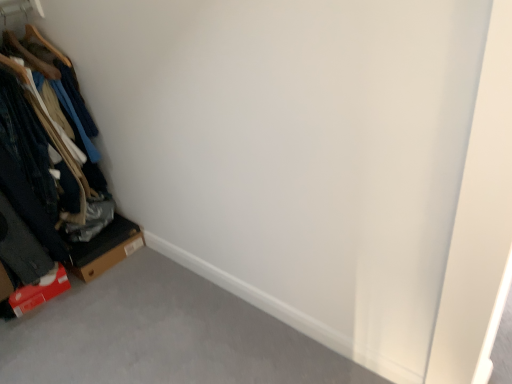
Question: In terms of size, does wooden hangers at left appear bigger or smaller than brown cardboard box at lower left?

Choices:
 (A) big
 (B) small

Answer: (A)

Question: From their relative heights in the image, would you say wooden hangers at left is taller or shorter than brown cardboard box at lower left?

Choices:
 (A) short
 (B) tall

Answer: (B)

Question: In the image, is wooden hangers at left on the left side or the right side of brown cardboard box at lower left?

Choices:
 (A) left
 (B) right

Answer: (A)

Question: In terms of height, does brown cardboard box at lower left look taller or shorter compared to wooden hangers at left?

Choices:
 (A) tall
 (B) short

Answer: (B)

Question: Is brown cardboard box at lower left spatially inside wooden hangers at left, or outside of it?

Choices:
 (A) outside
 (B) inside

Answer: (A)

Question: Considering the positions of brown cardboard box at lower left and wooden hangers at left in the image, is brown cardboard box at lower left wider or thinner than wooden hangers at left?

Choices:
 (A) thin
 (B) wide

Answer: (A)

Question: From the image's perspective, relative to wooden hangers at left, is brown cardboard box at lower left above or below?

Choices:
 (A) below
 (B) above

Answer: (A)